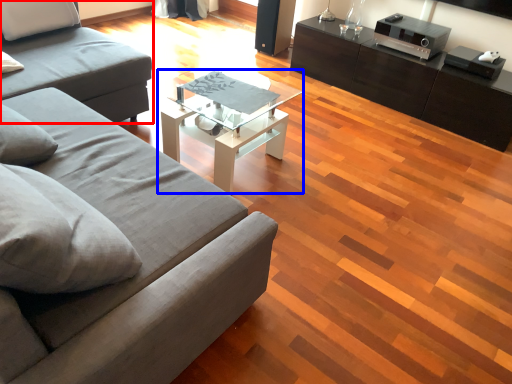
Question: Which object appears farthest to the camera in this image, studio couch (highlighted by a red box) or coffee table (highlighted by a blue box)?

Choices:
 (A) studio couch
 (B) coffee table

Answer: (B)